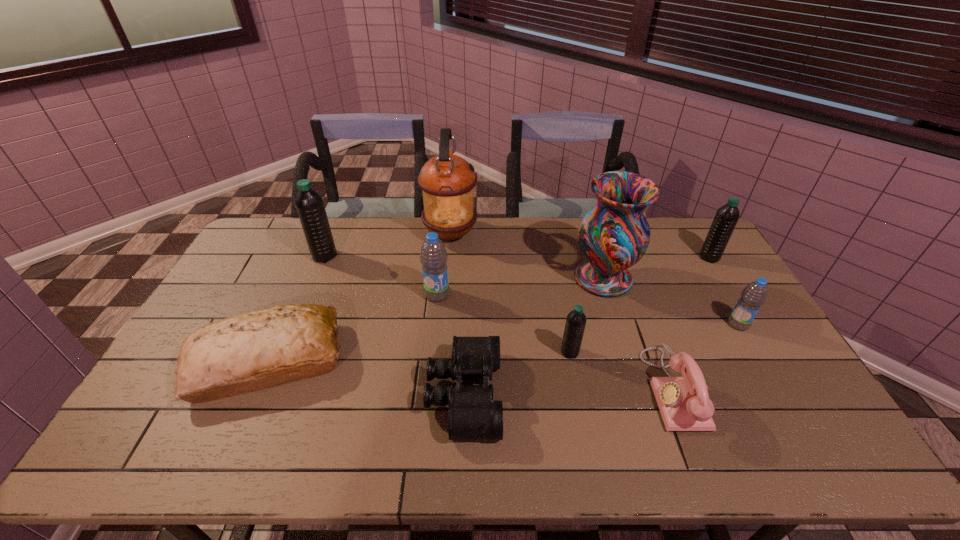
Where is `object at the left edge`? This screenshot has width=960, height=540. object at the left edge is located at coordinates (262, 349).

Find the location of a particular element. object located at the far right corner is located at coordinates (727, 216).

Where is `vacant space at the far edge of the desktop`? vacant space at the far edge of the desktop is located at coordinates (x=651, y=232).

The height and width of the screenshot is (540, 960). In order to click on free region at the right edge in this screenshot , I will do `click(723, 347)`.

The width and height of the screenshot is (960, 540). In order to click on vacant space in between the black binoculars and the bigger blue water bottle in this screenshot , I will do `click(450, 345)`.

Find the location of a particular element. The width and height of the screenshot is (960, 540). blank region between the vase and the second nearest water bottle is located at coordinates (671, 301).

Locate an element on the screen. This screenshot has height=540, width=960. unoccupied area between the right blue water bottle and the bread is located at coordinates (503, 343).

Locate an element on the screen. The image size is (960, 540). vacant area that lies between the binoculars and the oil lamp is located at coordinates (457, 314).

Where is `free space between the right blue water bottle and the leftmost water bottle`? free space between the right blue water bottle and the leftmost water bottle is located at coordinates (x=532, y=290).

This screenshot has height=540, width=960. In order to click on vacant area between the bread and the fourth farthest water bottle in this screenshot , I will do `click(503, 343)`.